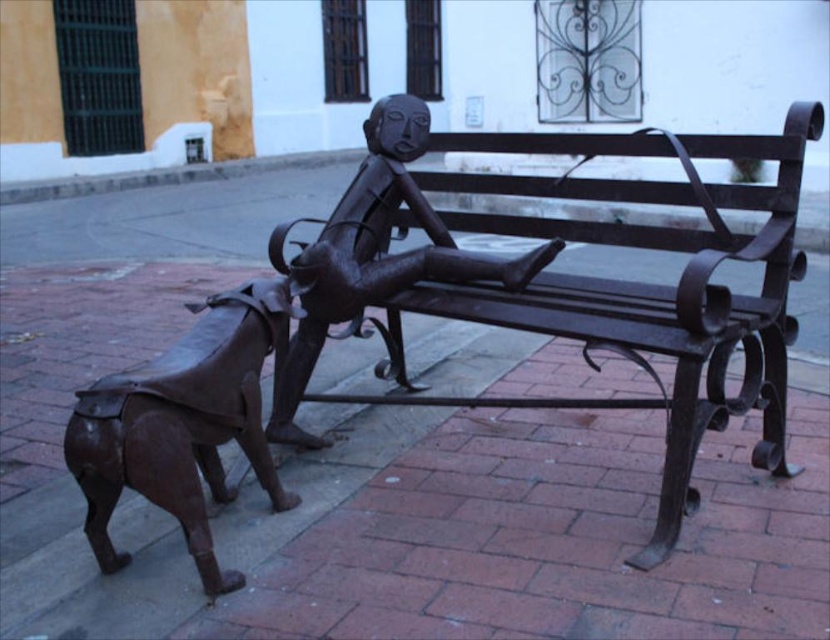
Question: Is the position of black wrought iron bench at center more distant than that of bronze figure at center?

Choices:
 (A) no
 (B) yes

Answer: (A)

Question: Which point is farther from the camera taking this photo?

Choices:
 (A) (498, 225)
 (B) (408, 182)

Answer: (A)

Question: Does black wrought iron bench at center appear on the right side of bronze dog at lower left?

Choices:
 (A) no
 (B) yes

Answer: (B)

Question: Does black wrought iron bench at center appear under brown polished metal dog at lower left?

Choices:
 (A) no
 (B) yes

Answer: (A)

Question: Which point is farther from the camera taking this photo?

Choices:
 (A) (774, 154)
 (B) (181, 464)

Answer: (A)

Question: Which object is positioned farthest from the bronze figure at center?

Choices:
 (A) black wrought iron bench at center
 (B) bronze dog at lower left
 (C) brown polished metal dog at lower left

Answer: (C)